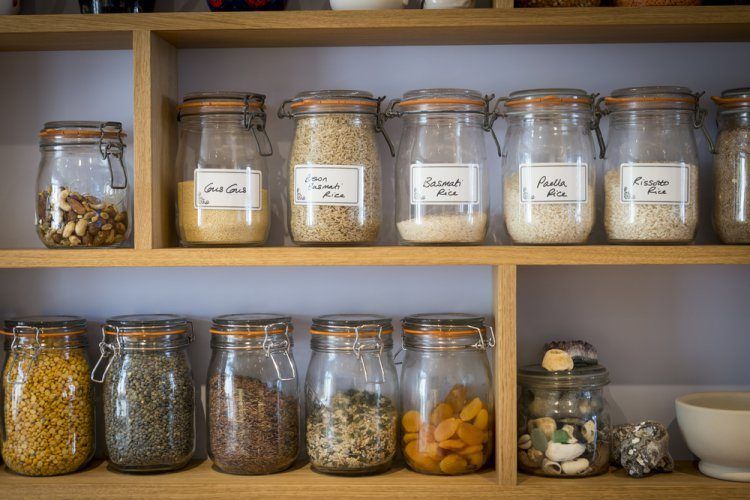
Find the location of `smaller jars`. smaller jars is located at coordinates (566, 405), (90, 163).